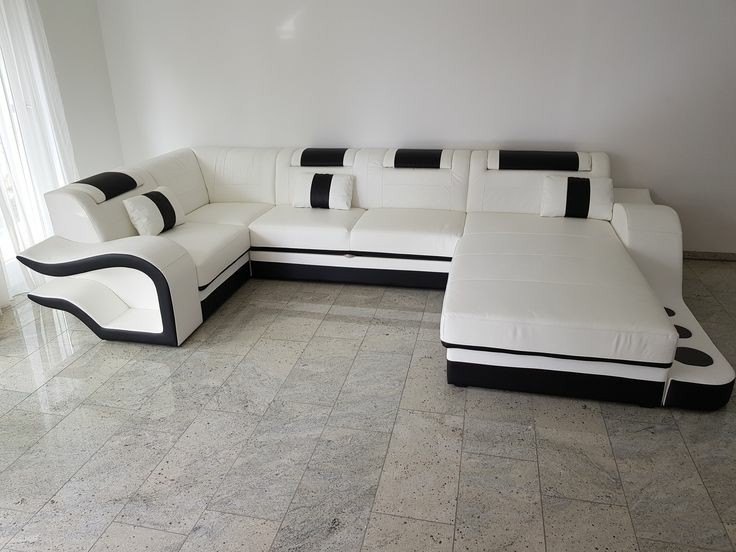
I want to click on floor, so click(364, 443).